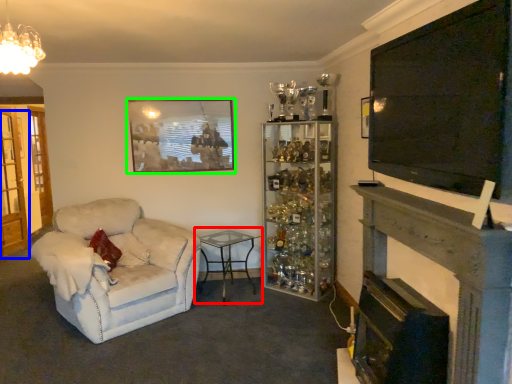
Question: Which object is positioned closest to table (highlighted by a red box)? Select from glass door (highlighted by a blue box) and picture frame (highlighted by a green box).

Choices:
 (A) glass door
 (B) picture frame

Answer: (B)